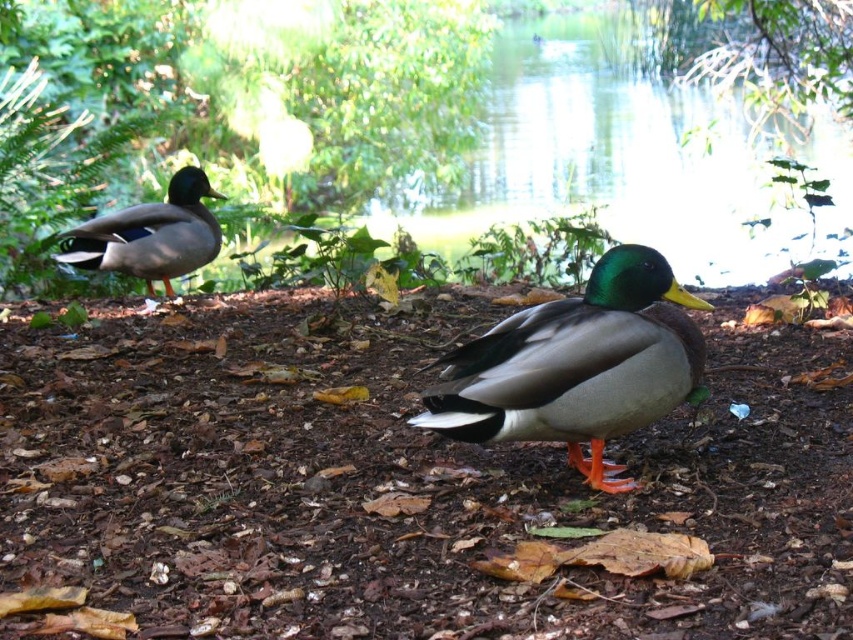
Question: Does green glossy duck at center appear over shiny green duck at left?

Choices:
 (A) no
 (B) yes

Answer: (A)

Question: Which object appears closest to the camera in this image?

Choices:
 (A) green glossy duck at center
 (B) shiny green duck at left

Answer: (A)

Question: Among these points, which one is nearest to the camera?

Choices:
 (A) (194, 179)
 (B) (518, 324)

Answer: (B)

Question: Which of the following is the closest to the observer?

Choices:
 (A) green glossy duck at center
 (B) shiny green duck at left

Answer: (A)

Question: Does green glossy duck at center have a larger size compared to shiny green duck at left?

Choices:
 (A) no
 (B) yes

Answer: (A)

Question: Can you confirm if green glossy duck at center is positioned below shiny green duck at left?

Choices:
 (A) no
 (B) yes

Answer: (B)